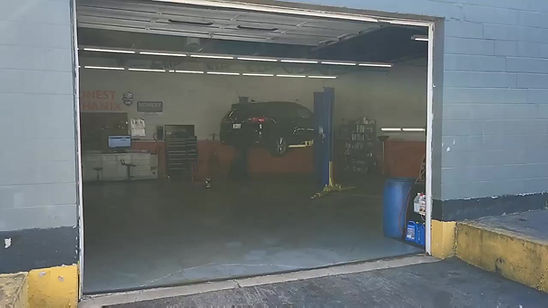
The width and height of the screenshot is (548, 308). In order to click on walls in this screenshot , I will do `click(205, 105)`.